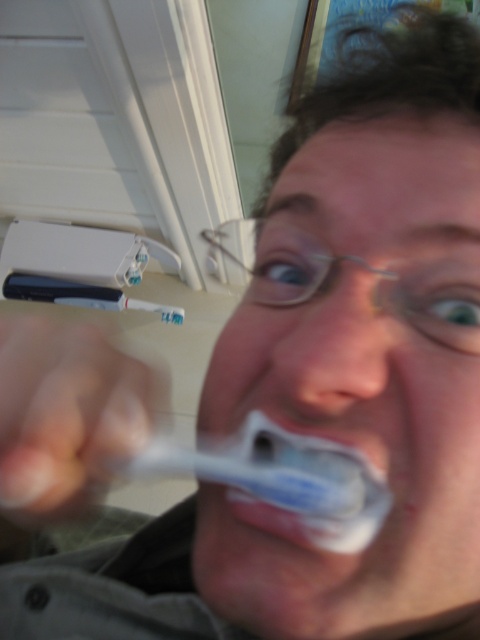
You are standing in a bathroom and see two points marked in the scene. The first point is at coordinate point (272, 528) and the second point is at coordinate point (192, 467). Which point is closer to you?

Point (272, 528) is closer to the viewer than point (192, 467).

You are a dentist advising a patient on choosing between the white soft toothbrush at center and the white plastic toothbrush at center. Which one is wider?

The white plastic toothbrush at center is wider than the white soft toothbrush at center.

You are a dentist advising a patient on choosing between the white soft toothbrush at center and the white plastic toothbrush at center. Which one is taller?

The white soft toothbrush at center is taller than the white plastic toothbrush at center according to the description.